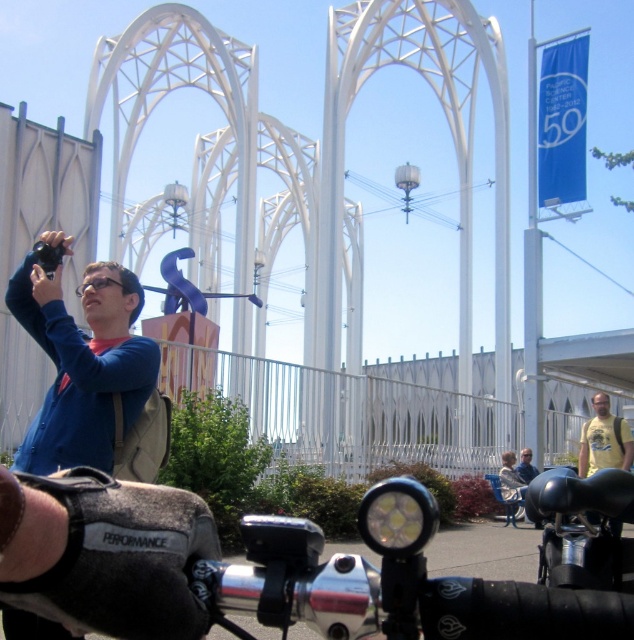
Looking at this image, can you confirm if shiny chrome handlebars at lower center is positioned to the left of yellow t-shirt at center?

Correct, you'll find shiny chrome handlebars at lower center to the left of yellow t-shirt at center.

Is point (235, 605) in front of point (592, 458)?

Yes, it is.

Between point (609, 605) and point (586, 420), which one is positioned in front?

Point (609, 605) is more forward.

Locate an element on the screen. shiny chrome handlebars at lower center is located at coordinates point(257,570).